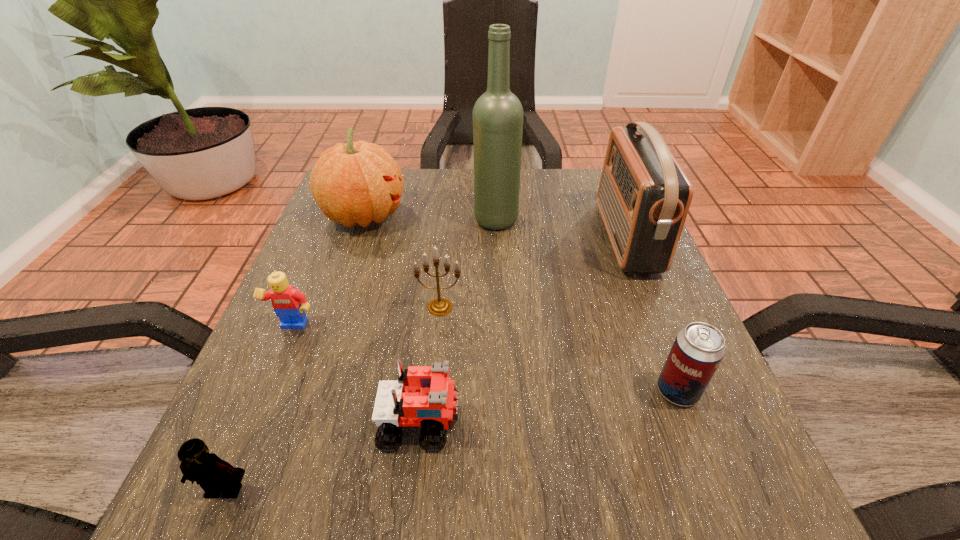
Identify the location of vacant area in the image that satisfies the following two spatial constraints: 1. on the front side of the beer can; 2. on the right side of the candelabrum. Image resolution: width=960 pixels, height=540 pixels. point(432,391).

Locate an element on the screen. vacant space that satisfies the following two spatial constraints: 1. on the back side of the candelabrum; 2. on the carved face of the third tallest object is located at coordinates (448, 215).

Identify the location of vacant space that satisfies the following two spatial constraints: 1. on the front-facing side of the radio receiver; 2. on the face of the nearest object. The height and width of the screenshot is (540, 960). (729, 489).